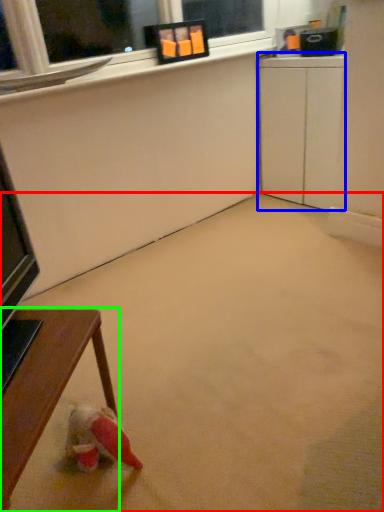
Question: Estimate the real-world distances between objects in this image. Which object is closer to concrete (highlighted by a red box), computer desk (highlighted by a blue box) or table (highlighted by a green box)?

Choices:
 (A) computer desk
 (B) table

Answer: (B)